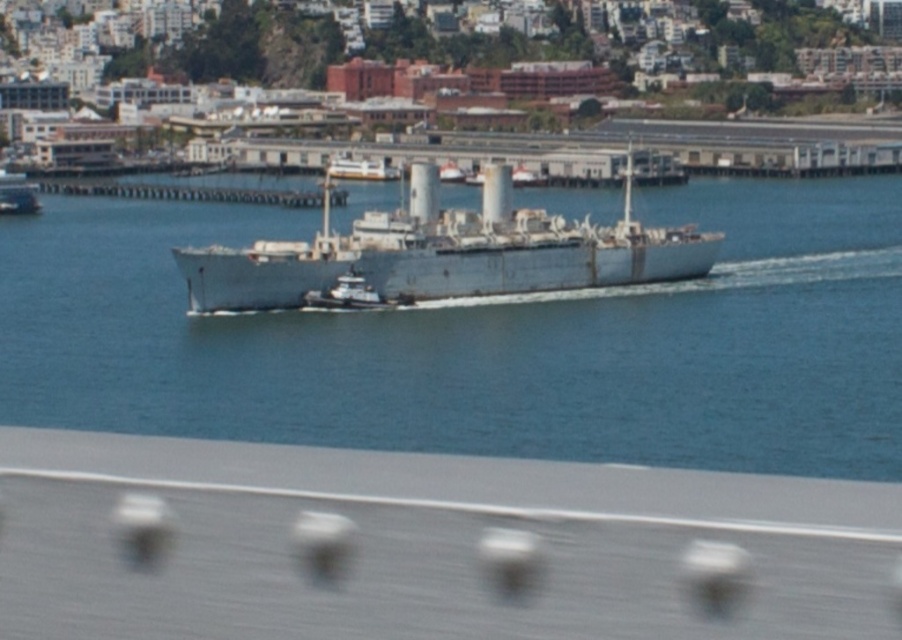
Question: Is gray metallic ship at center positioned before white matte ship at center?

Choices:
 (A) yes
 (B) no

Answer: (A)

Question: Based on their relative distances, which object is farther from the blue water at center?

Choices:
 (A) white matte ship at center
 (B) gray metallic ship at center

Answer: (A)

Question: Which of the following is the farthest from the observer?

Choices:
 (A) (5, 179)
 (B) (534, 442)
 (C) (496, 252)

Answer: (A)

Question: Is the position of blue water at center less distant than that of gray metallic ship at center?

Choices:
 (A) yes
 (B) no

Answer: (A)

Question: Is blue water at center smaller than gray metallic ship at center?

Choices:
 (A) no
 (B) yes

Answer: (A)

Question: Which point is closer to the camera taking this photo?

Choices:
 (A) (0, 196)
 (B) (492, 172)
 (C) (215, 355)

Answer: (C)